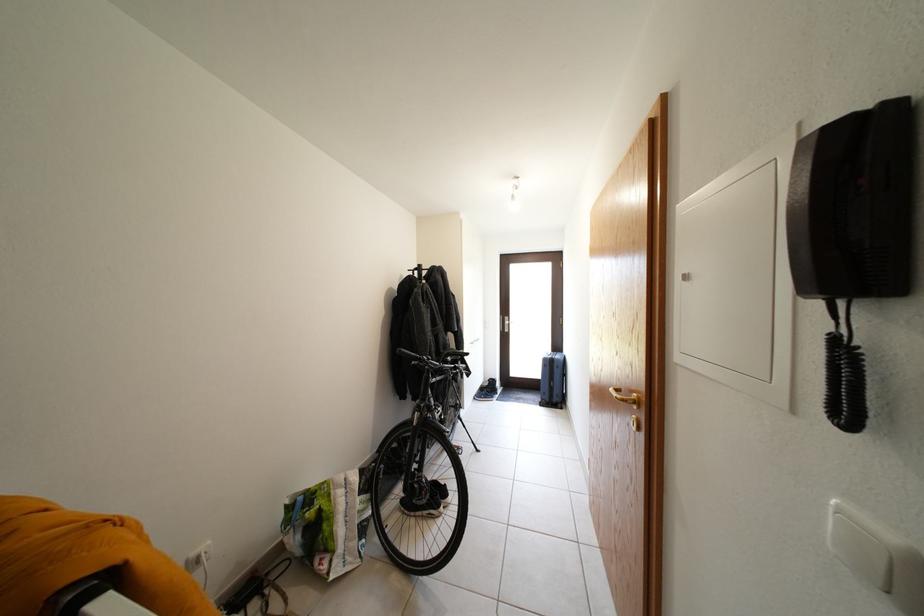
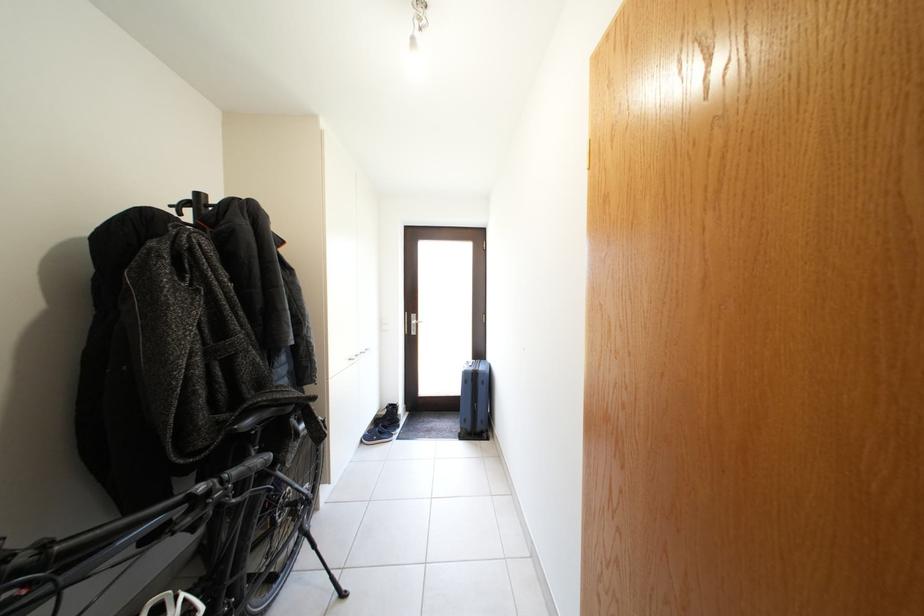
The point at (495, 397) is marked in the first image. Where is the corresponding point in the second image?

(392, 431)